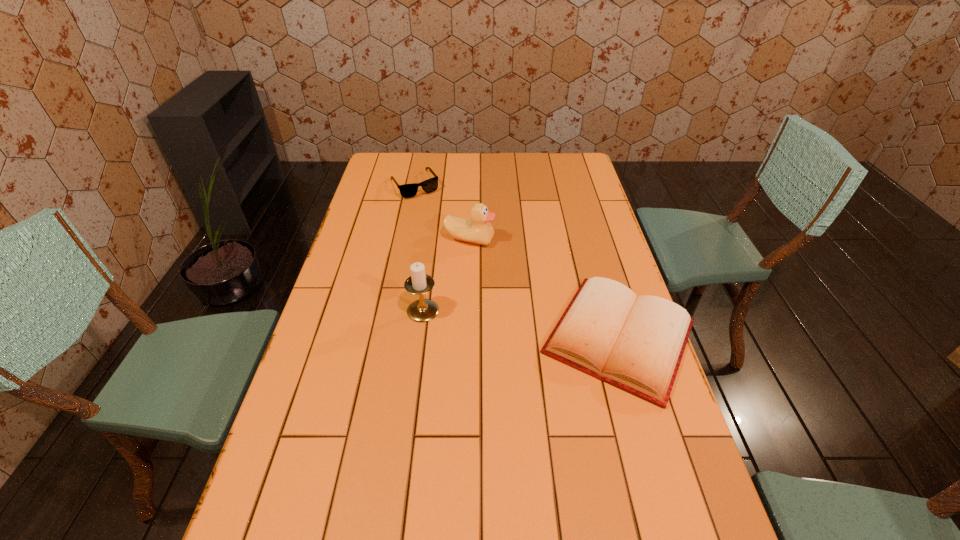
Locate an element on the screen. The height and width of the screenshot is (540, 960). blank area located 0.340m on the front-facing side of the sunglasses is located at coordinates (457, 248).

Find the location of a particular element. This screenshot has height=540, width=960. free space located on the front-facing side of the sunglasses is located at coordinates (455, 245).

The image size is (960, 540). Find the location of `vacant space situated at the beak of the second farthest object`. vacant space situated at the beak of the second farthest object is located at coordinates (494, 266).

You are a GUI agent. You are given a task and a screenshot of the screen. Output one action in this format:
    pyautogui.click(x=<x>, y=<y>)
    Task: Click on the free location located 0.080m at the beak of the second farthest object
    
    Given the screenshot: What is the action you would take?
    pyautogui.click(x=492, y=262)

This screenshot has height=540, width=960. I want to click on vacant area located 0.280m at the beak of the second farthest object, so click(x=523, y=302).

Locate an element on the screen. The image size is (960, 540). object that is at the far edge is located at coordinates (430, 185).

Find the location of a particular element. object that is positioned at the left edge is located at coordinates (430, 185).

Locate an element on the screen. This screenshot has height=540, width=960. object located at the right edge is located at coordinates (635, 343).

Where is `object present at the far left corner`? Image resolution: width=960 pixels, height=540 pixels. object present at the far left corner is located at coordinates (430, 185).

Locate an element on the screen. Image resolution: width=960 pixels, height=540 pixels. blank area at the far edge is located at coordinates (461, 156).